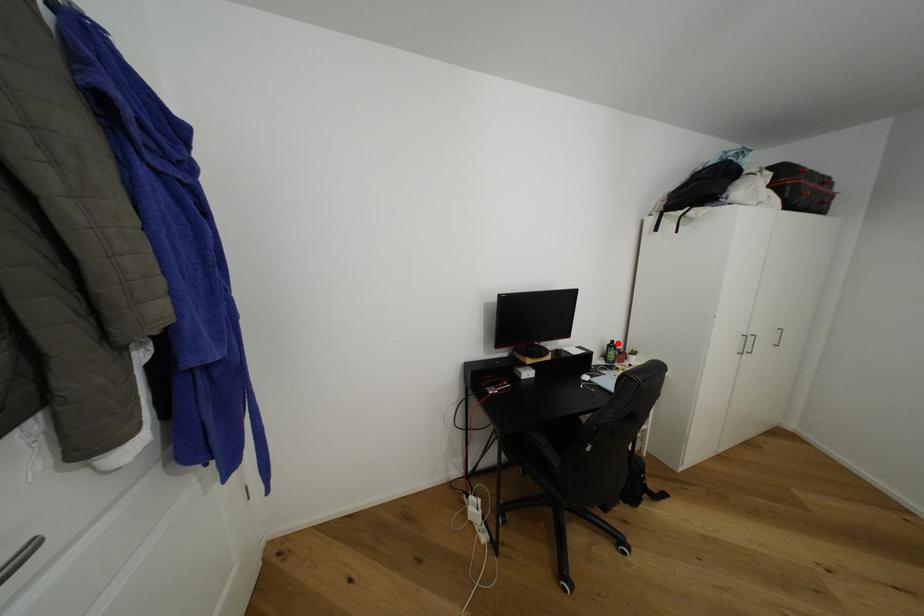
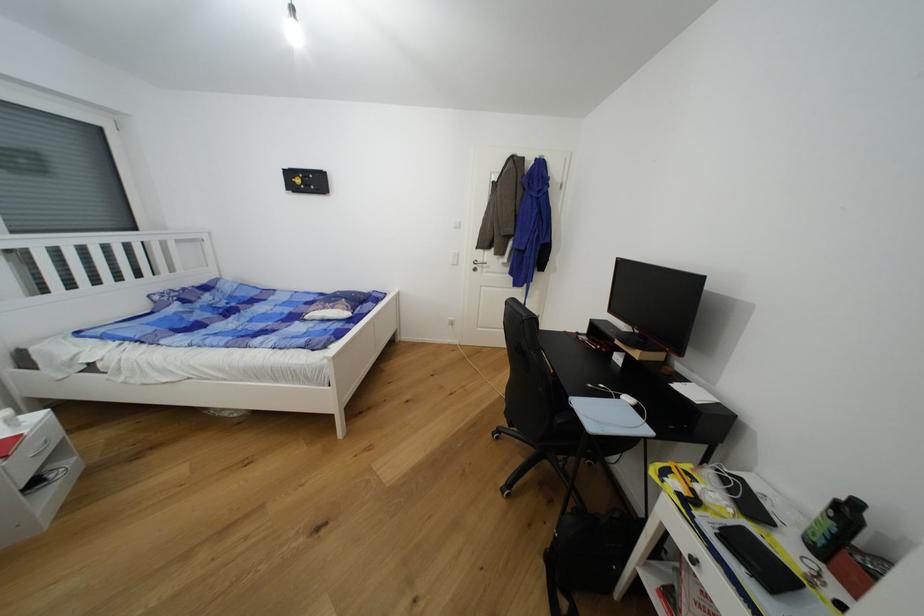
Locate, in the second image, the point that corresponds to the highlighted location in the first image.

(862, 506)